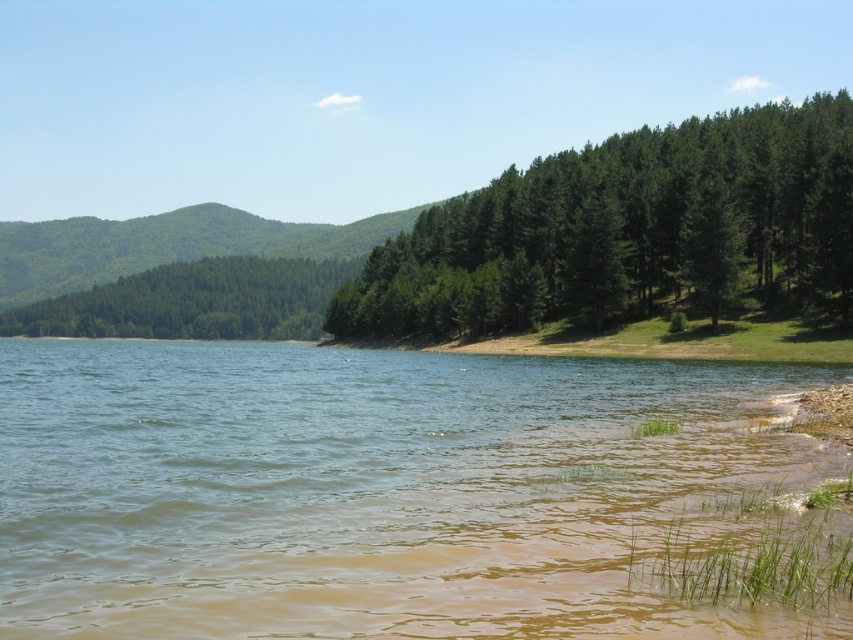
Is brown muddy water at lower center thinner than green leafy trees at right?

Yes.

Who is taller, brown muddy water at lower center or green leafy trees at right?

With more height is green leafy trees at right.

This screenshot has height=640, width=853. Describe the element at coordinates (369, 490) in the screenshot. I see `brown muddy water at lower center` at that location.

At what (x,y) coordinates should I click in order to perform the action: click on brown muddy water at lower center. Please return your answer as a coordinate pair (x, y). This screenshot has width=853, height=640. Looking at the image, I should click on (369, 490).

Who is lower down, green leafy trees at right or green leafy trees at left?

Positioned lower is green leafy trees at left.

Does green leafy trees at right lie behind green leafy trees at left?

No, green leafy trees at right is closer to the viewer.

Is point (671, 285) more distant than point (105, 288)?

No, (671, 285) is closer to viewer.

The height and width of the screenshot is (640, 853). I want to click on green leafy trees at right, so click(628, 228).

Looking at this image, does brown muddy water at lower center lie behind green leafy trees at left?

No, it is not.

In the scene shown: Is brown muddy water at lower center to the left of green leafy trees at left from the viewer's perspective?

Incorrect, brown muddy water at lower center is not on the left side of green leafy trees at left.

Identify the location of brown muddy water at lower center. (369, 490).

The image size is (853, 640). Find the location of `brown muddy water at lower center`. brown muddy water at lower center is located at coordinates (369, 490).